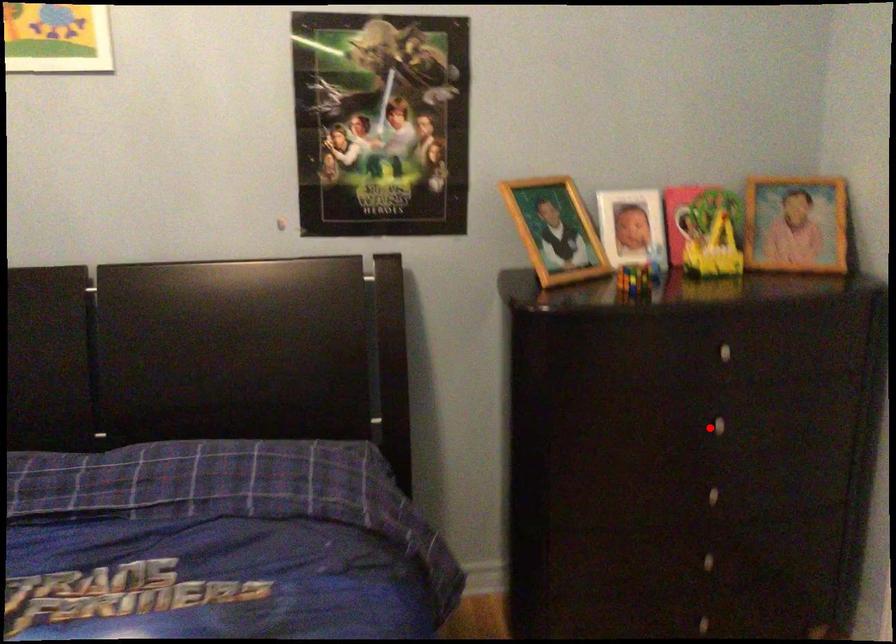
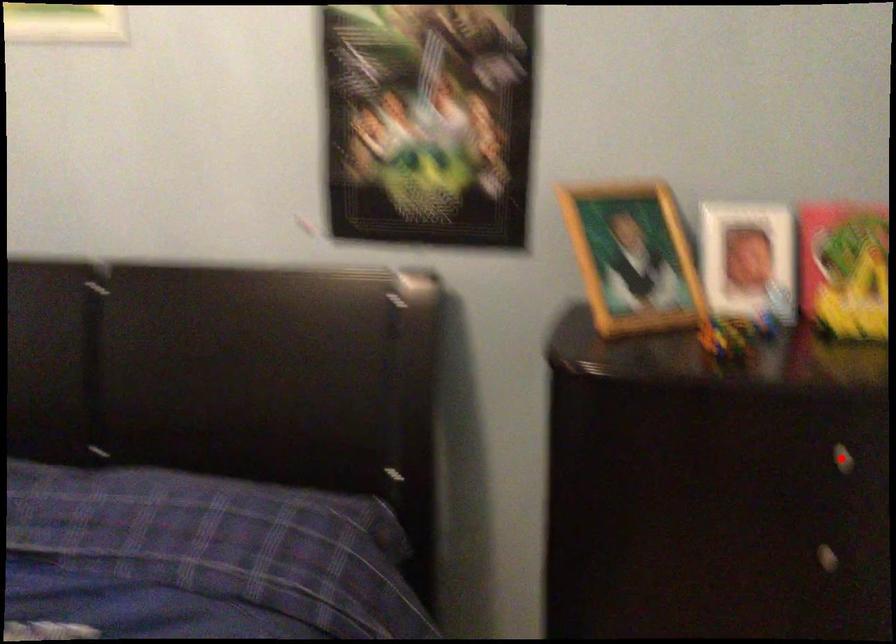
I am providing you with two images of the same scene from different viewpoints. A red point is marked on the first image and another point is marked on the second image. Is the red point in image1 aligned with the point shown in image2?

No